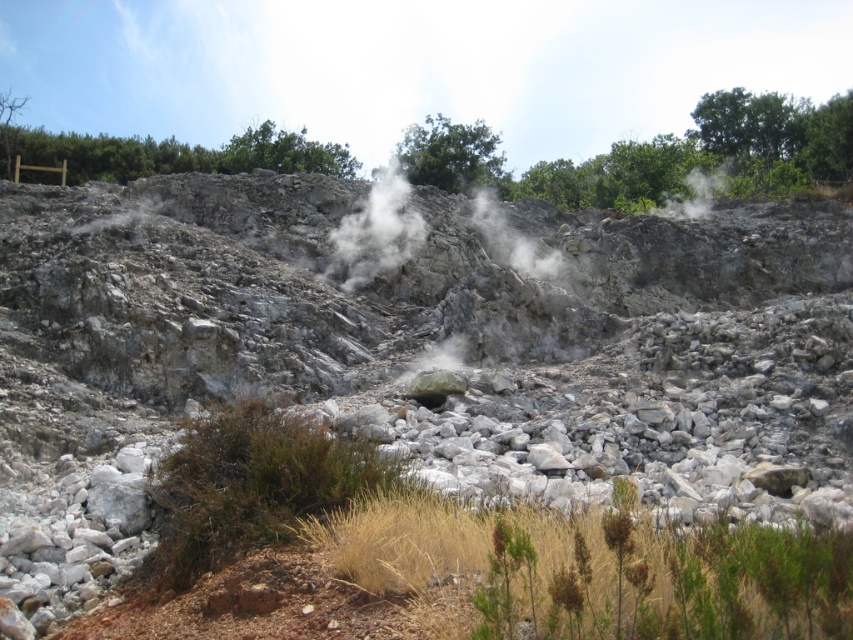
You are a geologist studying the landscape. You observe the white vapor at center. Based on its position, can you determine if it is located in the central part of the scene?

The white vapor at center is located at point coordinates of (x=376, y=232), which is within the central area of the scene.

You are a hiker trying to determine the safest path through the rocky terrain. You notice two plumes of white vapor at center and white smoke at upper center. Which one is closer to you?

The white vapor at center is closer to the viewer than the white smoke at upper center, so the white vapor at center is the closer one.

You are standing at the point with coordinates point (341, 252) and want to walk towards the point with coordinates point (686, 209). Given the rocky and uneven terrain described, will you have to go uphill or downhill?

Since point (341, 252) is in front of point (686, 209), you would be moving towards a point that is behind you in the scene. However, the terrain is rugged and uneven with large stones and possible elevation changes. Without specific elevation data, it is impossible to determine if you would go uphill or downhill.